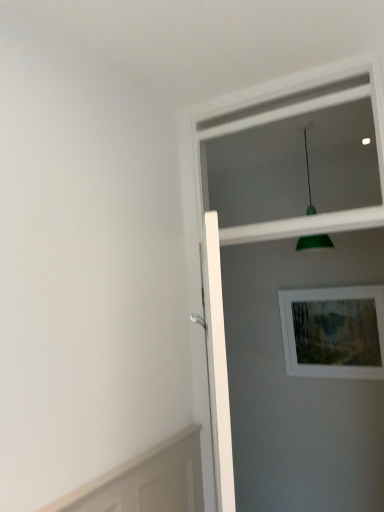
Question: From a real-world perspective, is wooden picture frame at upper right on top of white glossy screen door at upper right?

Choices:
 (A) no
 (B) yes

Answer: (B)

Question: Is wooden picture frame at upper right outside of white glossy screen door at upper right?

Choices:
 (A) no
 (B) yes

Answer: (B)

Question: Does wooden picture frame at upper right come in front of white glossy screen door at upper right?

Choices:
 (A) yes
 (B) no

Answer: (B)

Question: Is wooden picture frame at upper right facing away from white glossy screen door at upper right?

Choices:
 (A) yes
 (B) no

Answer: (B)

Question: Can you confirm if wooden picture frame at upper right is bigger than white glossy screen door at upper right?

Choices:
 (A) no
 (B) yes

Answer: (A)

Question: Is white glossy screen door at upper right inside wooden picture frame at upper right?

Choices:
 (A) no
 (B) yes

Answer: (A)

Question: Is white glossy screen door at upper right oriented towards green matte pendant light at upper center?

Choices:
 (A) no
 (B) yes

Answer: (A)

Question: Can green matte pendant light at upper center be found inside white glossy screen door at upper right?

Choices:
 (A) yes
 (B) no

Answer: (B)

Question: Is white glossy screen door at upper right directly adjacent to green matte pendant light at upper center?

Choices:
 (A) no
 (B) yes

Answer: (A)

Question: Is white glossy screen door at upper right positioned with its back to green matte pendant light at upper center?

Choices:
 (A) no
 (B) yes

Answer: (A)

Question: Does white glossy screen door at upper right have a greater width compared to green matte pendant light at upper center?

Choices:
 (A) no
 (B) yes

Answer: (A)

Question: From a real-world perspective, is white glossy screen door at upper right below green matte pendant light at upper center?

Choices:
 (A) yes
 (B) no

Answer: (A)

Question: Is green matte pendant light at upper center at the back of wooden picture frame at upper right?

Choices:
 (A) no
 (B) yes

Answer: (A)